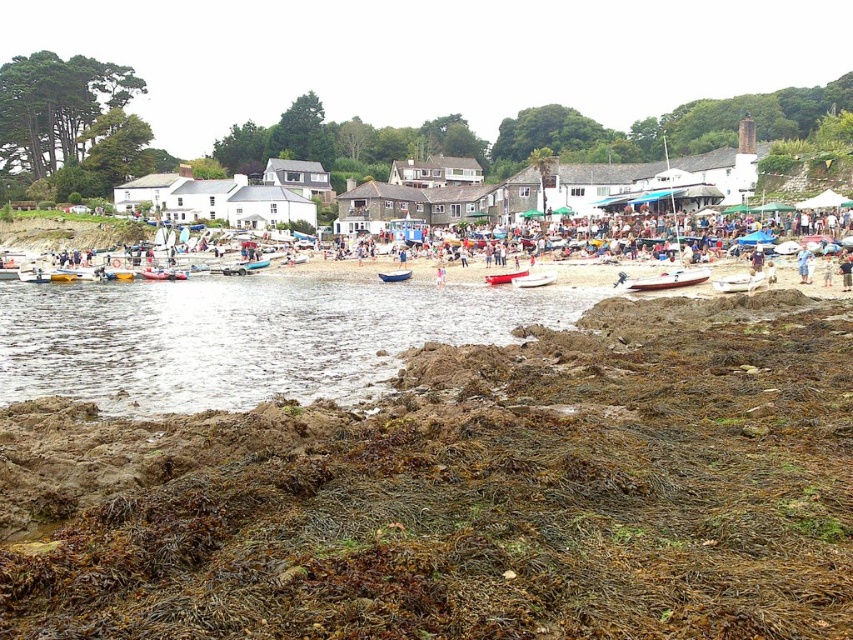
You are organizing a childrens boat race on the beach. You have two boats available for the race track, the white plastic boat at center and the red plastic boat at center. Which boat has a smaller width and would require a narrower lane?

The white plastic boat at center has a smaller width than the red plastic boat at center, so it would require a narrower lane.

You are standing at the origin point of this coastal scene. Which direction should you move to reach the white plastic boat at lower left?

Since the white plastic boat at lower left is located at coordinates 0.428 on the x axis and 0.040 on the y axis, you should move towards the lower left direction to reach it.